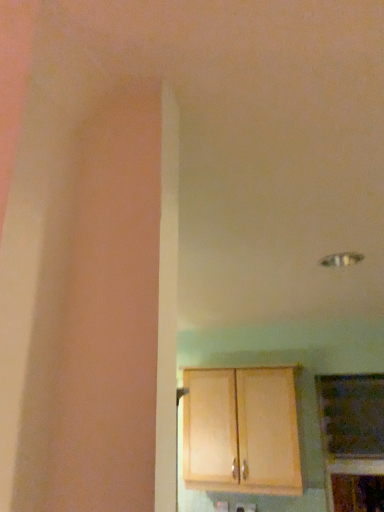
Describe the element at coordinates (241, 431) in the screenshot. I see `light wood cabinet at lower center` at that location.

This screenshot has width=384, height=512. Identify the location of light wood cabinet at lower center. (241, 431).

Find the location of a particular element. The image size is (384, 512). light wood cabinet at lower center is located at coordinates (241, 431).